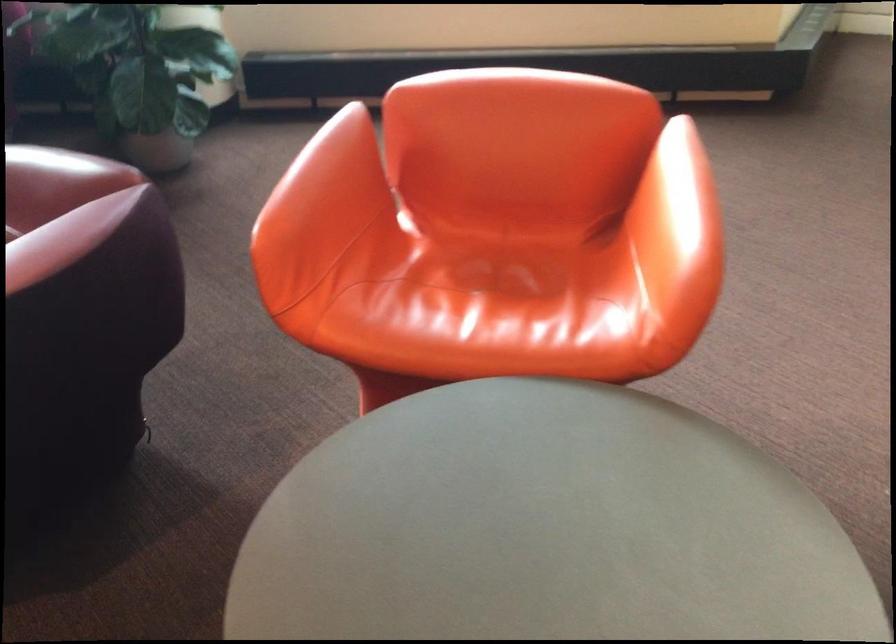
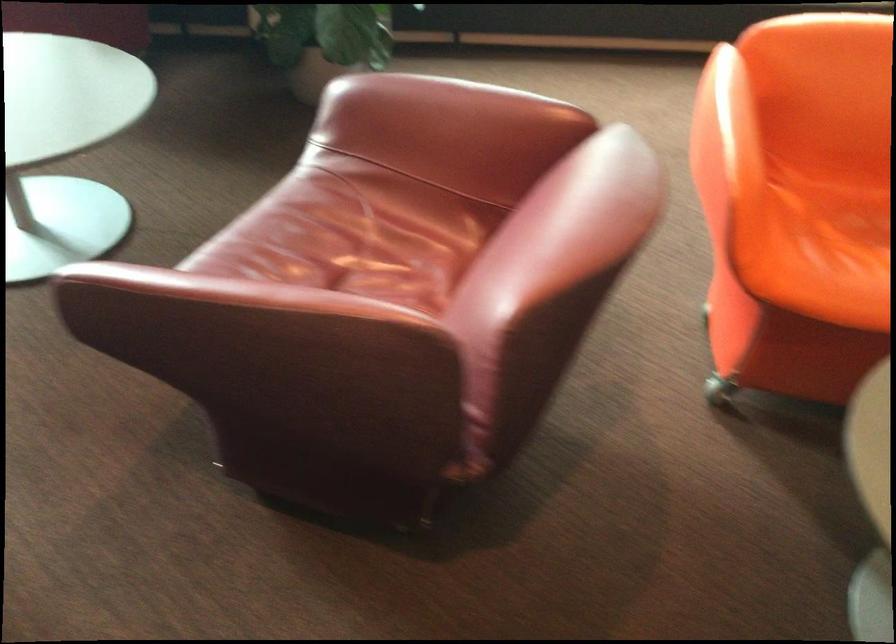
Question: What movement of the cameraman would produce the second image?

Choices:
 (A) Left
 (B) Right
 (C) Forward
 (D) Backward

Answer: (A)